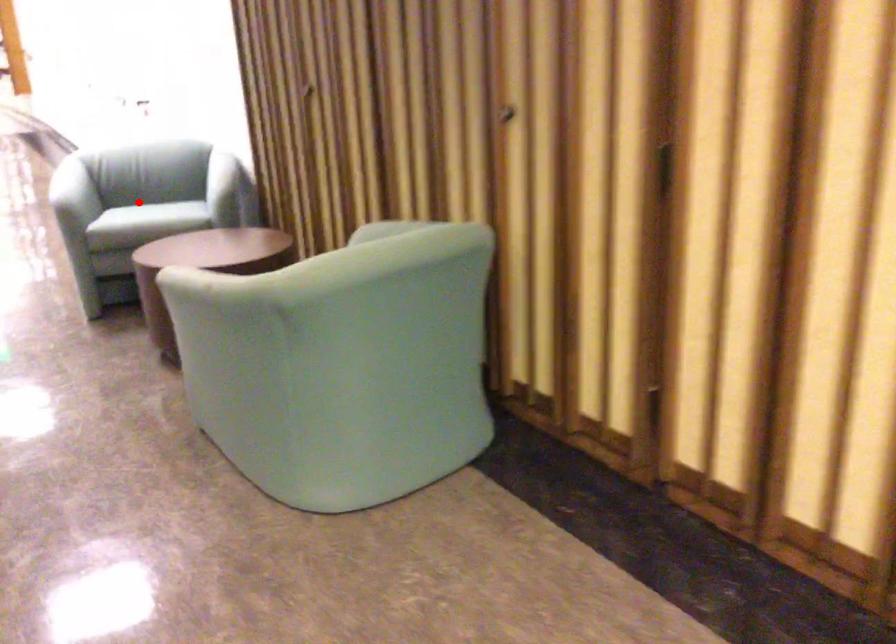
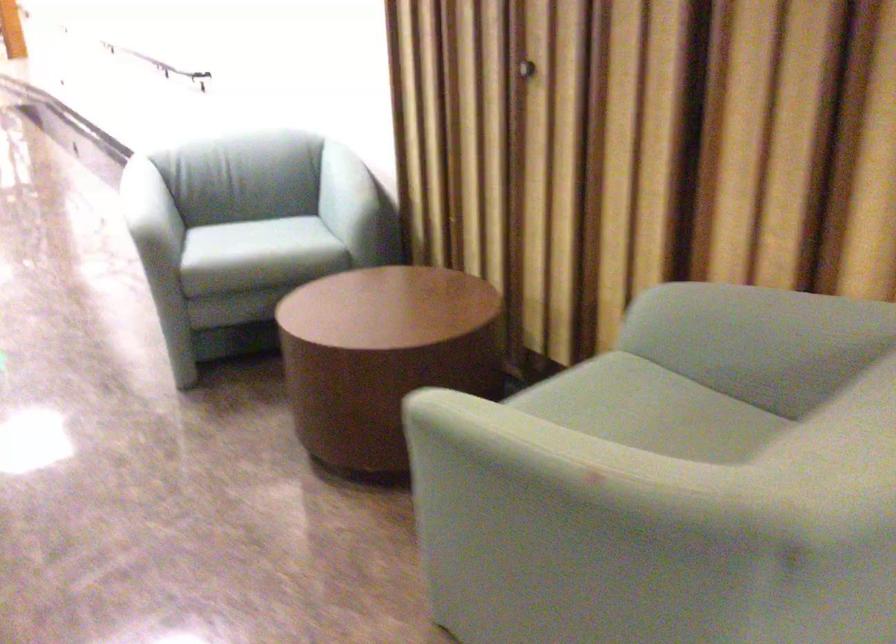
In the second image, find the point that corresponds to the highlighted location in the first image.

(265, 243)